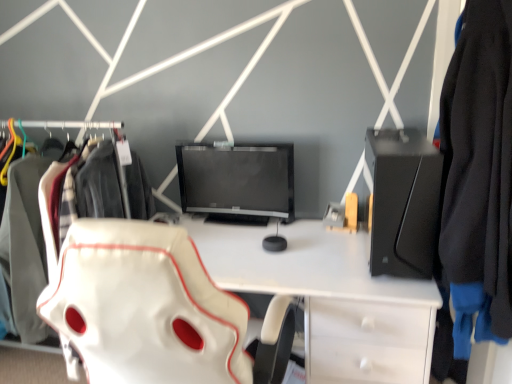
Question: Is white leather desk at center bigger or smaller than black matte desktop at right?

Choices:
 (A) big
 (B) small

Answer: (A)

Question: Is white leather desk at center inside the boundaries of black matte desktop at right, or outside?

Choices:
 (A) outside
 (B) inside

Answer: (A)

Question: Which object is positioned farthest from the white leather desk at center?

Choices:
 (A) white leather swivel chair at center
 (B) matte black monitor at center
 (C) black matte desktop at right
 (D) white fabric bag at left
 (E) black fabric jacket at right

Answer: (D)

Question: Which of these objects is positioned farthest from the white fabric bag at left?

Choices:
 (A) black fabric jacket at right
 (B) white leather swivel chair at center
 (C) white leather desk at center
 (D) black matte desktop at right
 (E) matte black monitor at center

Answer: (A)